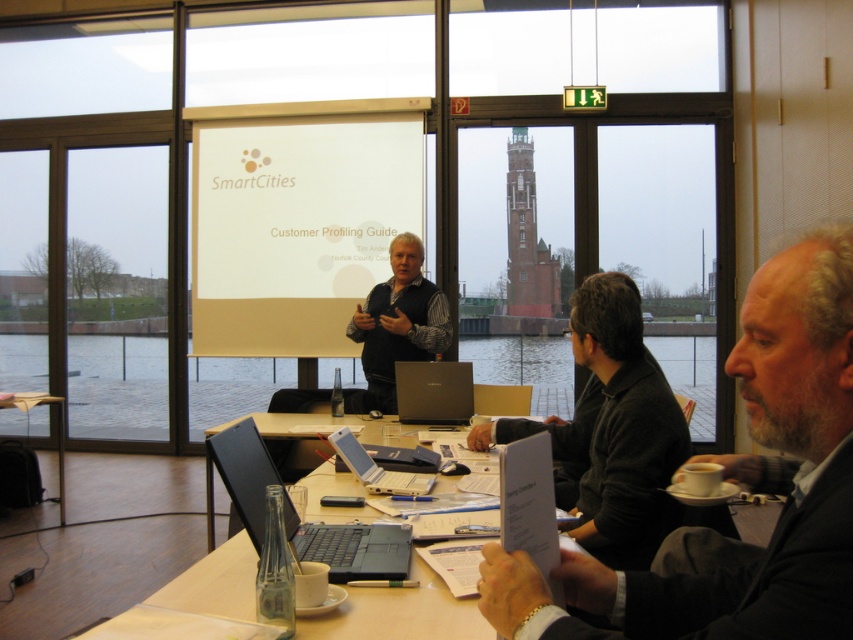
You are a participant in the meeting and need to present a slide. You see the matte black shirt at center and the satin black laptop at center. Which object should you look at to ensure your presentation is visible on the projector screen?

The matte black shirt at center is taller than the satin black laptop at center, so you should look at the matte black shirt at center to ensure your presentation is visible on the projector screen since it is positioned higher.

You are a participant in the presentation. You want to hand a document to the presenter who is wearing the matte black shirt at center. The laptop is in your way. Can you reach the presenter without moving the satin black laptop at center?

The matte black shirt at center is further to the viewer than the satin black laptop at center, so the laptop is between you and the presenter. Therefore, you cannot reach the presenter without moving the laptop.